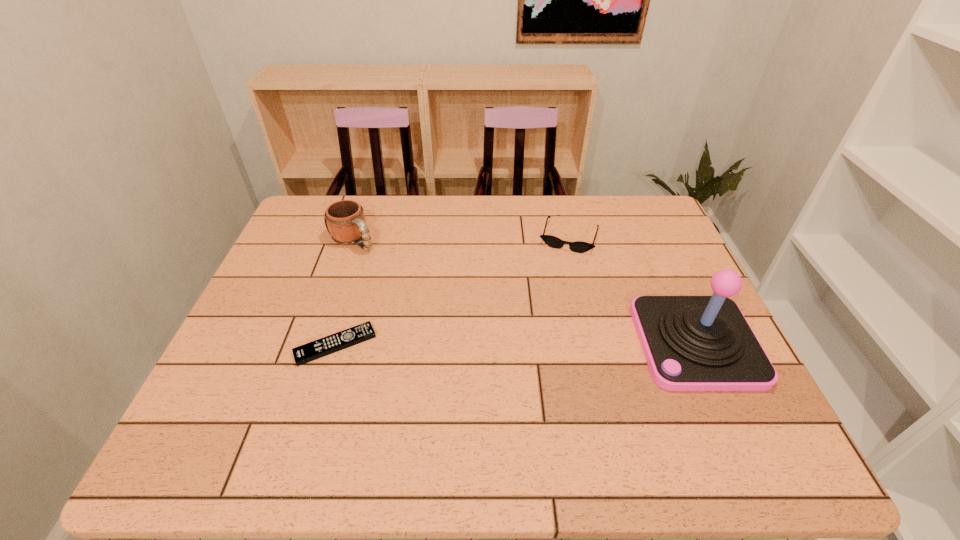
The width and height of the screenshot is (960, 540). In order to click on mug present at the left edge in this screenshot , I will do `click(346, 224)`.

Image resolution: width=960 pixels, height=540 pixels. What are the coordinates of `object that is at the right edge` in the screenshot? It's located at (691, 343).

Identify the location of object at the far left corner. (346, 224).

You are a GUI agent. You are given a task and a screenshot of the screen. Output one action in this format:
    pyautogui.click(x=<x>, y=<y>)
    Task: Click on the object present at the near right corner
    The height and width of the screenshot is (540, 960).
    Given the screenshot: What is the action you would take?
    pyautogui.click(x=691, y=343)

Where is `vacant region at the far edge of the desktop`? This screenshot has height=540, width=960. vacant region at the far edge of the desktop is located at coordinates (406, 218).

At what (x,y) coordinates should I click in order to perform the action: click on vacant space at the near edge of the desktop. Please return your answer as a coordinate pair (x, y). This screenshot has width=960, height=540. Looking at the image, I should click on (398, 407).

Identify the location of vacant space at the left edge of the desktop. (287, 341).

Locate an element on the screen. The height and width of the screenshot is (540, 960). vacant space at the right edge of the desktop is located at coordinates (646, 275).

Image resolution: width=960 pixels, height=540 pixels. What are the coordinates of `vacant space at the far left corner` in the screenshot? It's located at click(318, 215).

You are a GUI agent. You are given a task and a screenshot of the screen. Output one action in this format:
    pyautogui.click(x=<x>, y=<y>)
    Task: Click on the vacant space that's between the tallest object and the mug
    This screenshot has width=960, height=540.
    Given the screenshot: What is the action you would take?
    pyautogui.click(x=524, y=292)